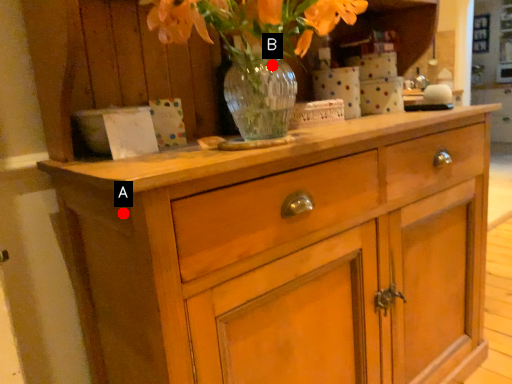
Question: Two points are circled on the image, labeled by A and B beside each circle. Which point is farther to the camera?

Choices:
 (A) A is further
 (B) B is further

Answer: (B)